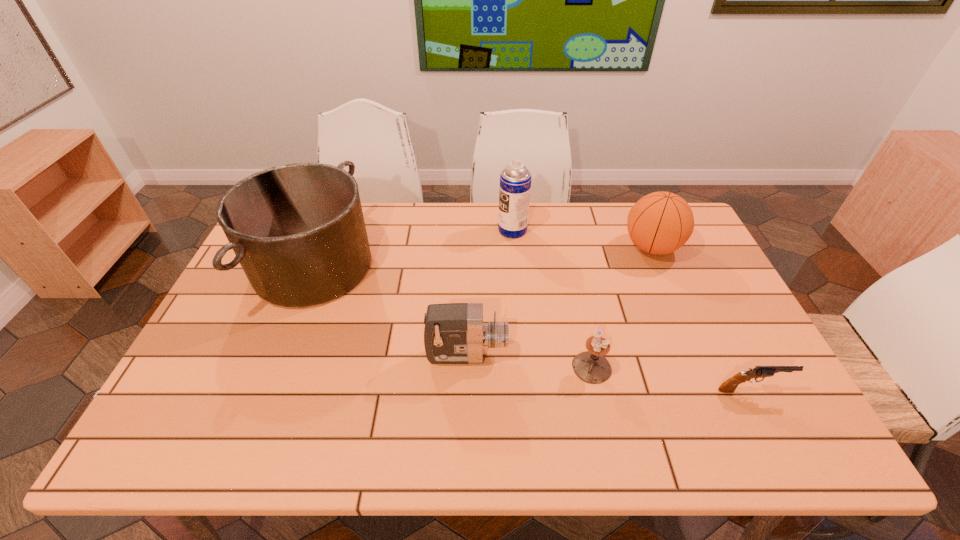
Locate an element on the screen. The width and height of the screenshot is (960, 540). vacant space situated on the label side of the aerosol can is located at coordinates 388,230.

This screenshot has width=960, height=540. What are the coordinates of `vacant space located on the front of the leftmost object` in the screenshot? It's located at (281, 347).

In order to click on free region located 0.070m on the left of the basketball in this screenshot , I will do 601,247.

In order to click on vacant space located 0.280m at the front of the camcorder, highlighting the lens in this screenshot , I will do `click(614, 355)`.

I want to click on vacant space located on the right of the candle holder, so click(682, 367).

I want to click on aerosol can that is at the far edge, so click(515, 180).

At what (x,y) coordinates should I click in order to perform the action: click on pan located in the far edge section of the desktop. Please return your answer as a coordinate pair (x, y). This screenshot has height=540, width=960. Looking at the image, I should click on (298, 231).

Locate an element on the screen. Image resolution: width=960 pixels, height=540 pixels. basketball that is positioned at the far edge is located at coordinates (659, 223).

Where is `object positioned at the left edge`? object positioned at the left edge is located at coordinates (298, 231).

This screenshot has width=960, height=540. Find the location of `basketball at the right edge`. basketball at the right edge is located at coordinates (659, 223).